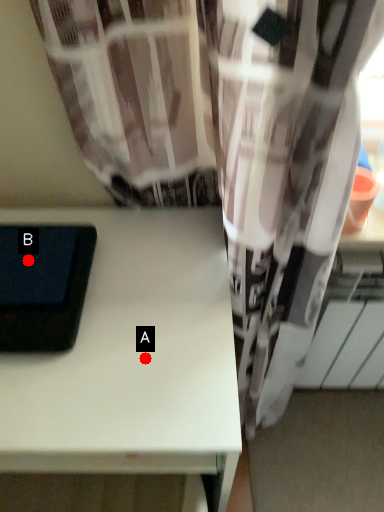
Question: Two points are circled on the image, labeled by A and B beside each circle. Which point appears farthest from the camera in this image?

Choices:
 (A) A is further
 (B) B is further

Answer: (B)